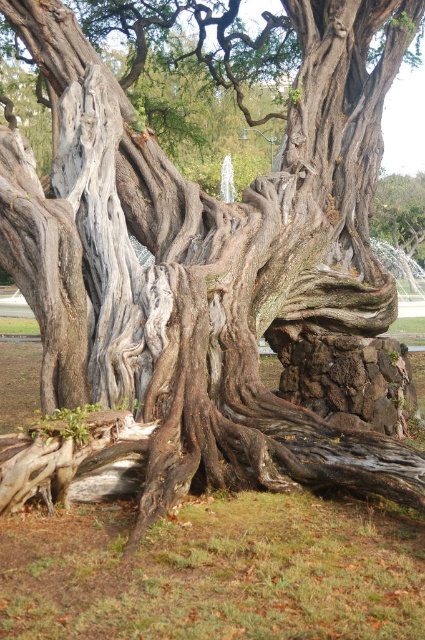
Question: Can you confirm if gray rough bark tree root at center is bigger than gray rough bark tree at center?

Choices:
 (A) no
 (B) yes

Answer: (A)

Question: Which point is closer to the camera taking this photo?

Choices:
 (A) coord(411,189)
 (B) coord(0,440)

Answer: (B)

Question: Is gray rough bark tree root at center wider than gray rough bark tree at center?

Choices:
 (A) no
 (B) yes

Answer: (A)

Question: Among these points, which one is farthest from the camera?

Choices:
 (A) (396, 211)
 (B) (34, 436)

Answer: (A)

Question: Can you confirm if gray rough bark tree root at center is positioned to the right of gray rough bark tree at center?

Choices:
 (A) yes
 (B) no

Answer: (B)

Question: Which point is closer to the camera?

Choices:
 (A) gray rough bark tree at center
 (B) gray rough bark tree root at center

Answer: (B)